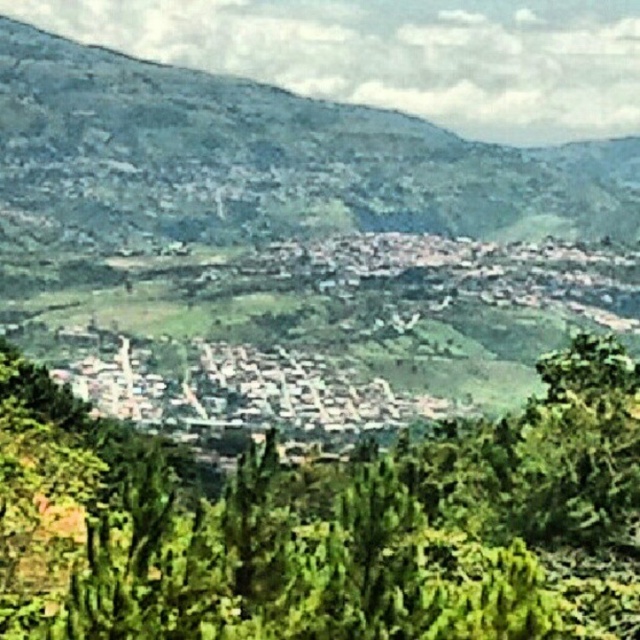
Can you confirm if green textured hillside at upper left is positioned above white stone buildings at center?

Yes, green textured hillside at upper left is above white stone buildings at center.

Does green textured hillside at upper left appear on the left side of white stone buildings at center?

No, green textured hillside at upper left is not to the left of white stone buildings at center.

Find the location of `green textured hillside at upper left`. green textured hillside at upper left is located at coordinates (266, 160).

Identify the location of green textured hillside at upper left. This screenshot has width=640, height=640. (266, 160).

Does point (192, 572) lie behind point (1, 45)?

No, it is not.

Is green leafy tree at center smaller than green textured hillside at upper left?

Yes, green leafy tree at center is smaller than green textured hillside at upper left.

Identify the location of green leafy tree at center. This screenshot has height=640, width=640. (326, 524).

Does point (180, 579) come closer to viewer compared to point (374, 406)?

Yes, point (180, 579) is closer to viewer.

Is green leafy tree at center positioned before white stone buildings at center?

That is True.

Who is more forward, (x=572, y=576) or (x=106, y=372)?

Point (x=572, y=576) is in front.

Locate an element on the screen. green leafy tree at center is located at coordinates (326, 524).